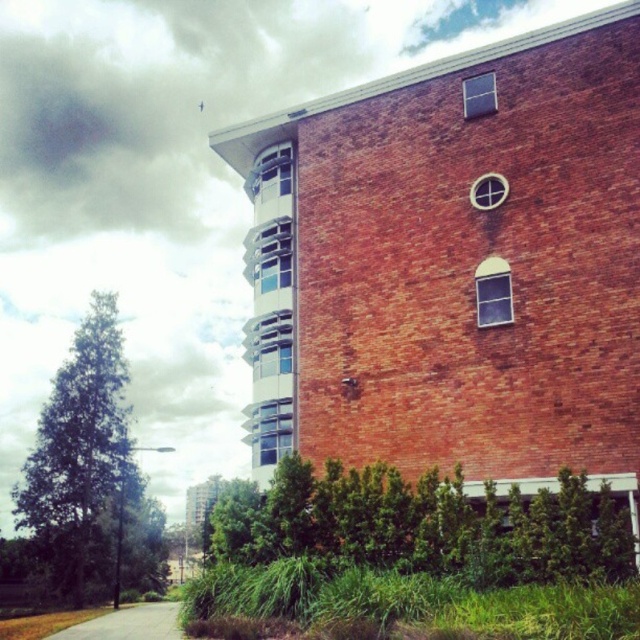
Is point (477, 422) positioned after point (170, 611)?

No, it is not.

Who is lower down, red brick building at center or smooth asphalt road at lower left?

smooth asphalt road at lower left is below.

Between point (422, 355) and point (170, 602), which one is positioned behind?

Positioned behind is point (170, 602).

This screenshot has width=640, height=640. Find the location of `red brick building at center`. red brick building at center is located at coordinates (454, 264).